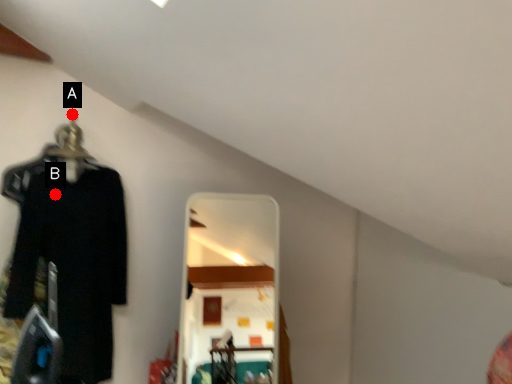
Question: Two points are circled on the image, labeled by A and B beside each circle. Which of the following is the closest to the observer?

Choices:
 (A) A is closer
 (B) B is closer

Answer: (B)